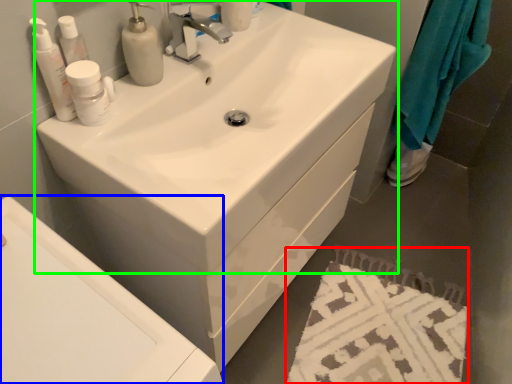
Question: Which is nearer to the bath mat (highlighted by a red box)? bath (highlighted by a blue box) or sink (highlighted by a green box).

Choices:
 (A) bath
 (B) sink

Answer: (B)